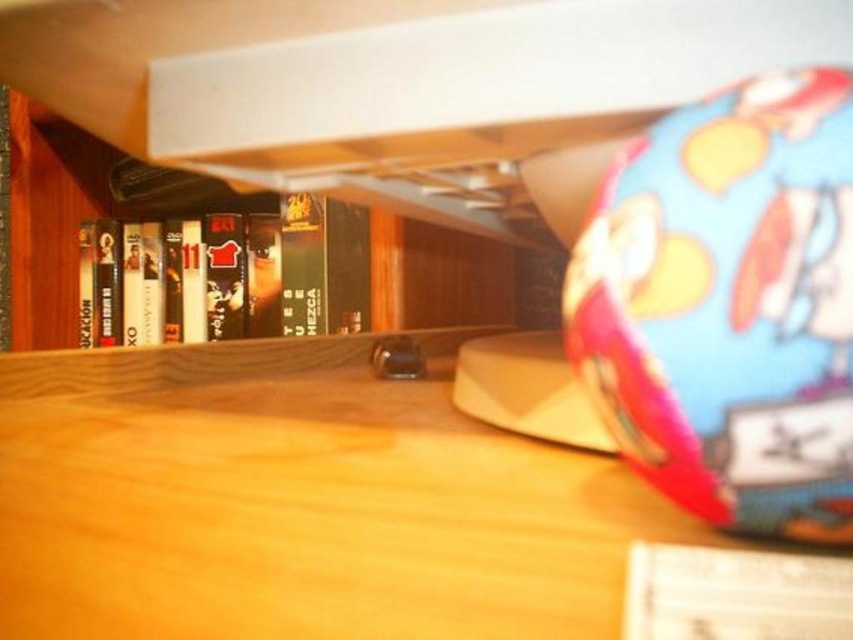
Measure the distance from black matte book at center to black matte dvd case at center.

A distance of 2.43 inches exists between black matte book at center and black matte dvd case at center.

Measure the distance from black matte book at center to black matte dvd case at center.

black matte book at center and black matte dvd case at center are 2.43 inches apart.

The image size is (853, 640). Identify the location of black matte book at center. (83, 211).

In order to click on black matte book at center in this screenshot , I will do `click(83, 211)`.

Does wooden table at center have a greater width compared to black matte book at center?

Incorrect, wooden table at center's width does not surpass black matte book at center's.

Image resolution: width=853 pixels, height=640 pixels. Describe the element at coordinates (299, 500) in the screenshot. I see `wooden table at center` at that location.

The height and width of the screenshot is (640, 853). Find the location of `wooden table at center`. wooden table at center is located at coordinates (299, 500).

Locate an element on the screen. wooden table at center is located at coordinates (299, 500).

Can you confirm if wooden table at center is smaller than black matte dvd case at center?

Yes, wooden table at center is smaller than black matte dvd case at center.

Is wooden table at center closer to the viewer compared to black matte dvd case at center?

Yes, wooden table at center is closer to the viewer.

I want to click on wooden table at center, so (x=299, y=500).

Locate an element on the screen. wooden table at center is located at coordinates (299, 500).